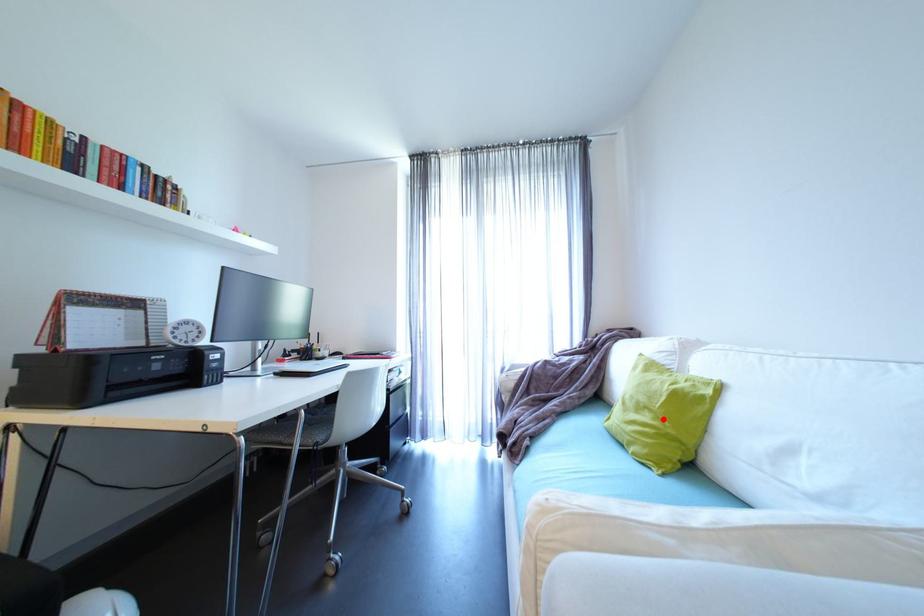
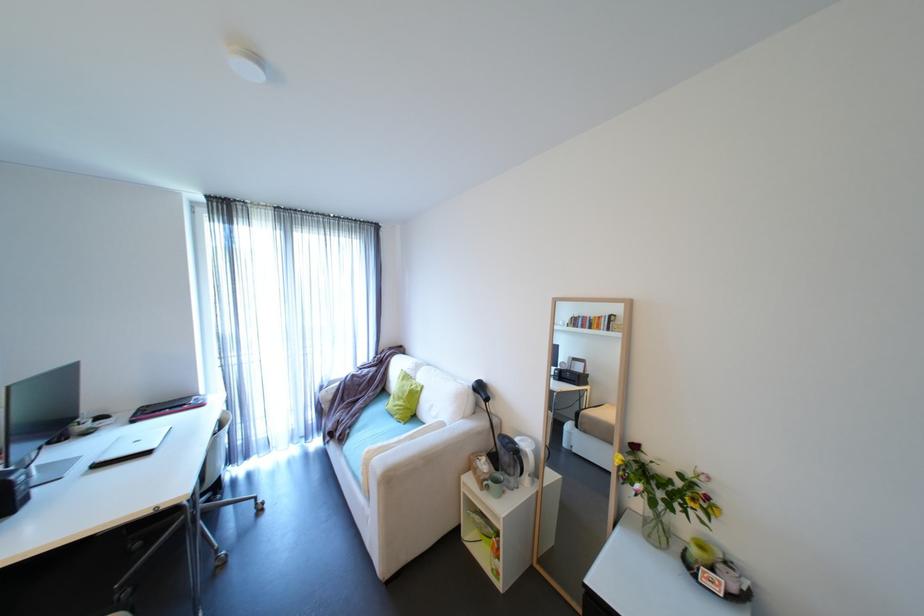
Question: A red point is marked in image1. In image2, is the corresponding 3D point closer to the camera or farther? Reply with the corresponding letter.

Choices:
 (A) The corresponding 3D point is closer.
 (B) The corresponding 3D point is farther.

Answer: (B)